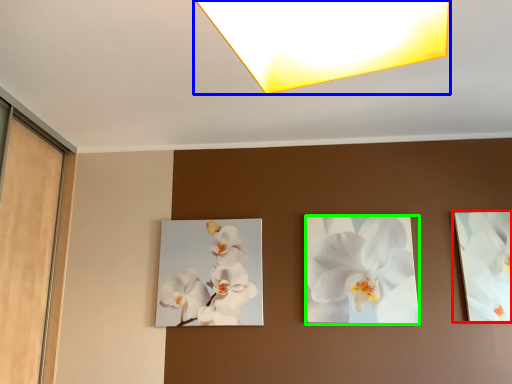
Question: Considering the real-world distances, which object is farthest from picture frame (highlighted by a red box)? lamp (highlighted by a blue box) or flower (highlighted by a green box)?

Choices:
 (A) lamp
 (B) flower

Answer: (A)